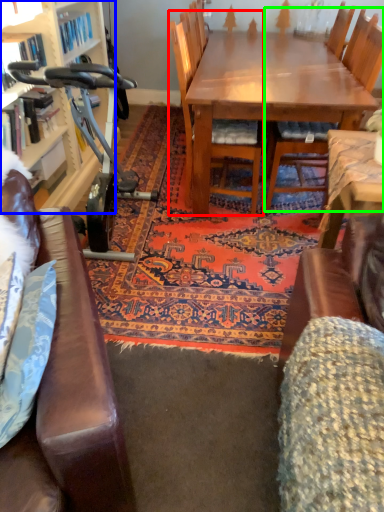
Question: Based on their relative distances, which object is farther from chair (highlighted by a red box)? Choose from bookcase (highlighted by a blue box) and chair (highlighted by a green box).

Choices:
 (A) bookcase
 (B) chair

Answer: (A)